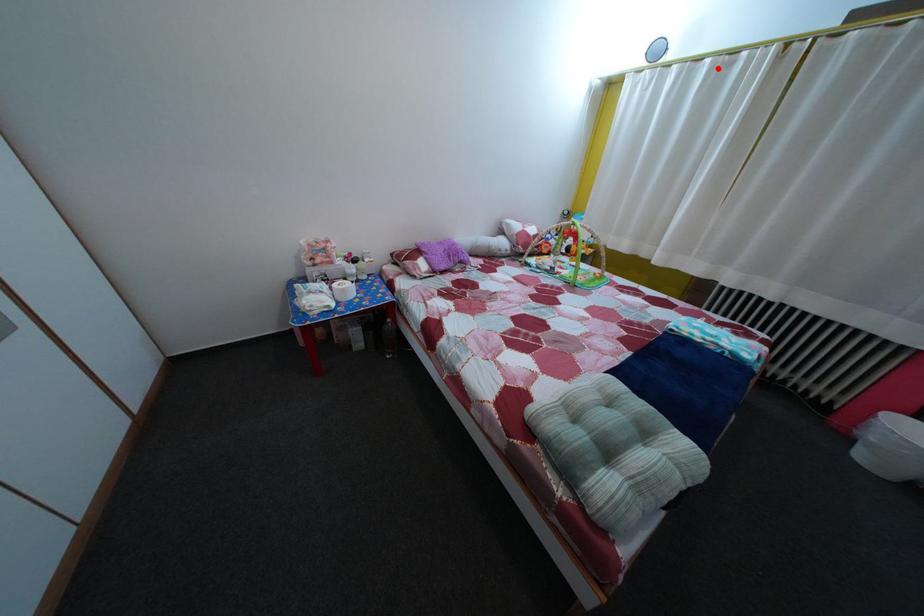
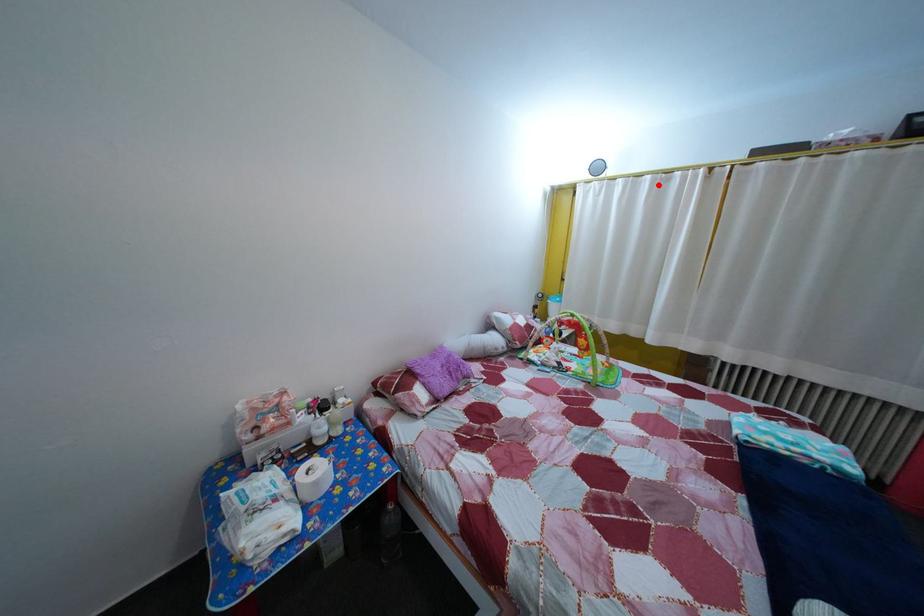
I am providing you with two images of the same scene from different viewpoints. A red point is marked on the first image and another point is marked on the second image. Do the highlighted points in image1 and image2 indicate the same real-world spot?

Yes